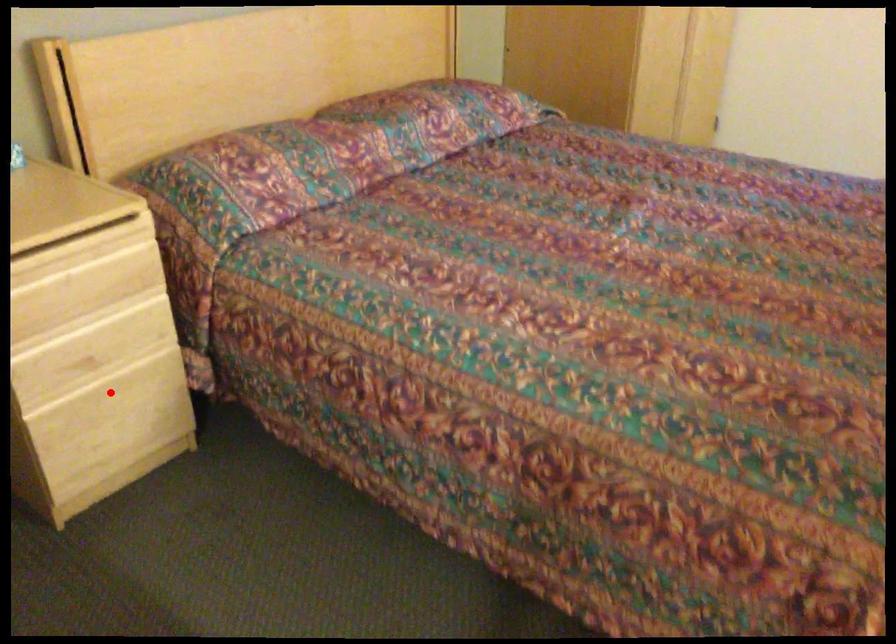
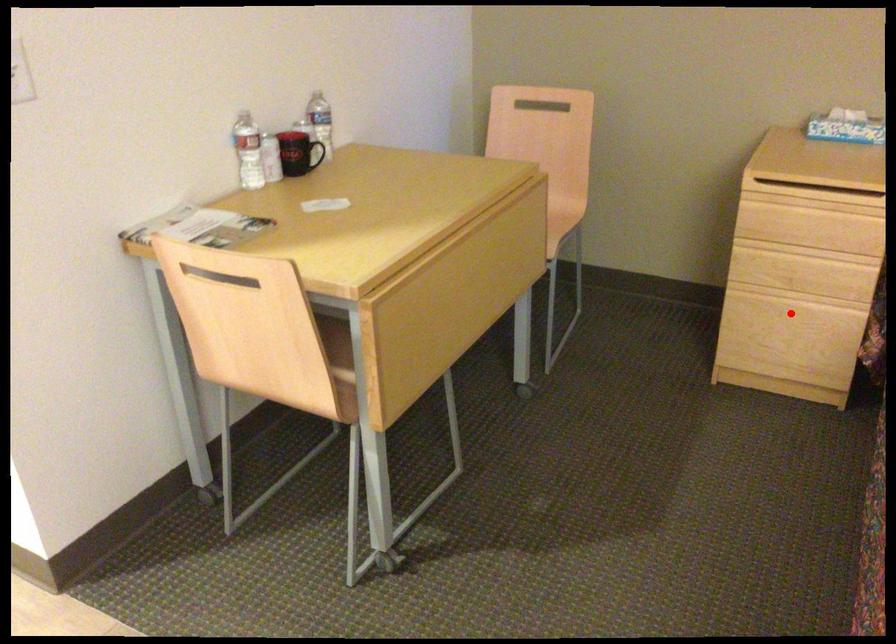
I am providing you with two images of the same scene from different viewpoints. A red point is marked on the first image and another point is marked on the second image. Are the points marked in image1 and image2 representing the same 3D position?

Yes